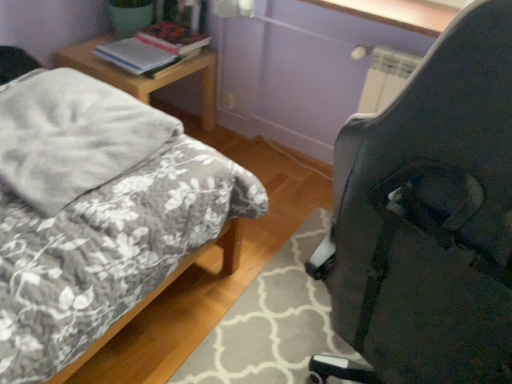
Question: Does black plastic chair at right turn towards hardcover book at upper left, which appears as the second book when viewed from the front?

Choices:
 (A) no
 (B) yes

Answer: (A)

Question: Can you confirm if black plastic chair at right is positioned to the left of hardcover book at upper left, which appears as the second book when viewed from the front?

Choices:
 (A) no
 (B) yes

Answer: (A)

Question: Considering the relative sizes of black plastic chair at right and hardcover book at upper left, marked as the first book in a back-to-front arrangement, in the image provided, is black plastic chair at right thinner than hardcover book at upper left, marked as the first book in a back-to-front arrangement,?

Choices:
 (A) yes
 (B) no

Answer: (B)

Question: Is black plastic chair at right not close to hardcover book at upper left, marked as the first book in a back-to-front arrangement?

Choices:
 (A) yes
 (B) no

Answer: (A)

Question: Is black plastic chair at right to the right of hardcover book at upper left, marked as the first book in a back-to-front arrangement, from the viewer's perspective?

Choices:
 (A) no
 (B) yes

Answer: (B)

Question: From a real-world perspective, is woodennightstand at left above or below white glossy window sill at upper center?

Choices:
 (A) below
 (B) above

Answer: (A)

Question: Is woodennightstand at left situated inside white glossy window sill at upper center or outside?

Choices:
 (A) inside
 (B) outside

Answer: (B)

Question: From the image's perspective, is woodennightstand at left above or below white glossy window sill at upper center?

Choices:
 (A) below
 (B) above

Answer: (A)

Question: Is woodennightstand at left to the left or to the right of white glossy window sill at upper center in the image?

Choices:
 (A) left
 (B) right

Answer: (A)

Question: From the image's perspective, is floral-patterned fabric bed at left located above or below white paper stack at upper left, arranged as the second book when viewed from the back?

Choices:
 (A) above
 (B) below

Answer: (B)

Question: Considering the positions of floral-patterned fabric bed at left and white paper stack at upper left, arranged as the second book when viewed from the back, in the image, is floral-patterned fabric bed at left wider or thinner than white paper stack at upper left, arranged as the second book when viewed from the back,?

Choices:
 (A) wide
 (B) thin

Answer: (A)

Question: In the image, is floral-patterned fabric bed at left on the left side or the right side of white paper stack at upper left, the 1th book viewed from the front?

Choices:
 (A) left
 (B) right

Answer: (A)

Question: Is floral-patterned fabric bed at left inside or outside of white paper stack at upper left, arranged as the second book when viewed from the back?

Choices:
 (A) inside
 (B) outside

Answer: (B)

Question: In the image, is gray soft blanket at left positioned in front of or behind woodennightstand at left?

Choices:
 (A) behind
 (B) front

Answer: (B)

Question: Would you say gray soft blanket at left is to the left or to the right of woodennightstand at left in the picture?

Choices:
 (A) left
 (B) right

Answer: (A)